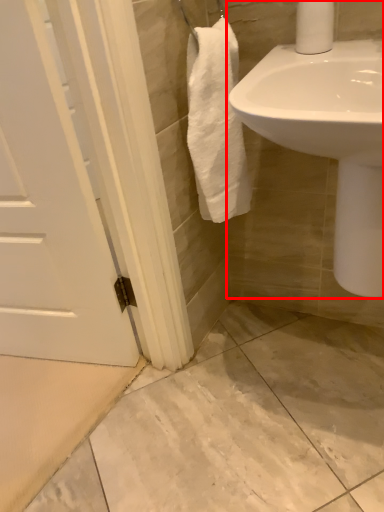
Question: From the image's perspective, where is sink (annotated by the red box) located relative to toilet paper?

Choices:
 (A) below
 (B) above

Answer: (A)